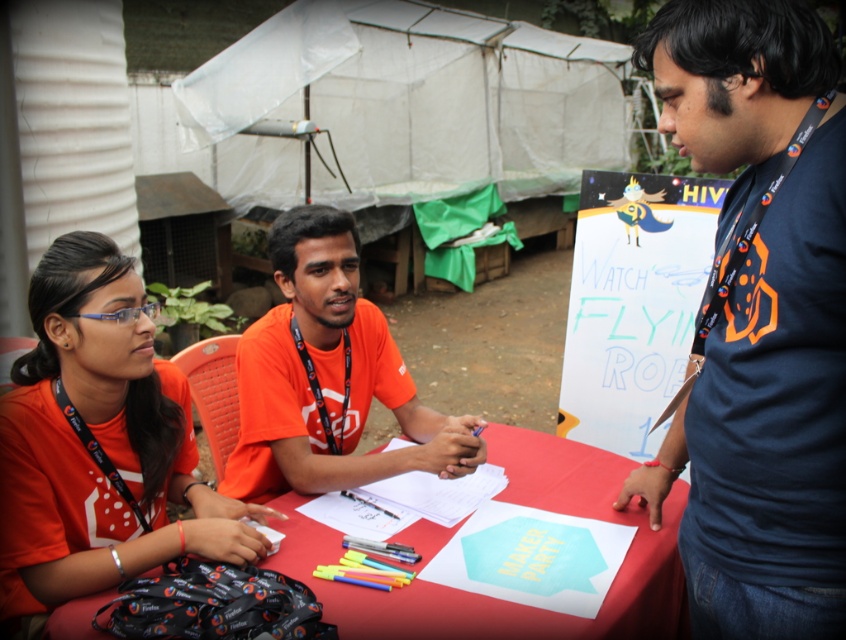
You are organizing an event and need to decide whether to place a large banner on the orange fabric shirt at center or the red fabric tablecloth at center. Based on their sizes, which surface would be more suitable for the banner?

The red fabric tablecloth at center occupies more space than the orange fabric shirt at center, so the banner would be more suitable for the red fabric tablecloth at center.